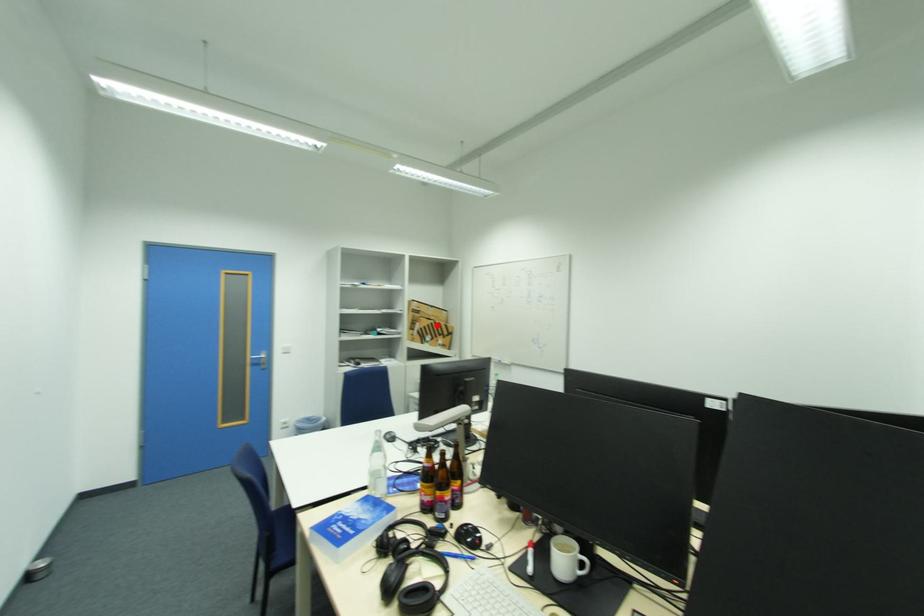
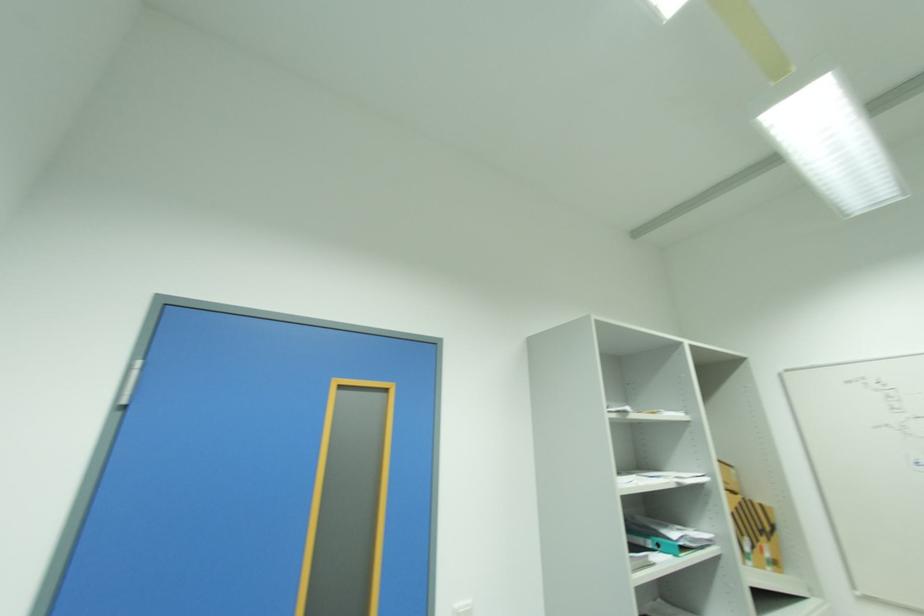
Question: I am providing you with two images of the same scene from different viewpoints. Given a red point in image1, look at the same physical point in image2. Is it:

Choices:
 (A) Closer to the viewpoint
 (B) Farther from the viewpoint

Answer: (A)